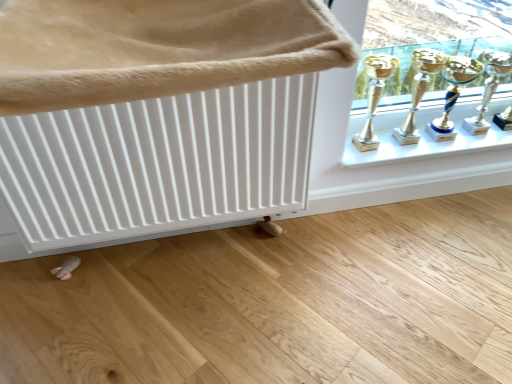
Question: From the image's perspective, is silver metallic trophy at upper right, the 1th candle holder when ordered from right to left, under white textured radiator at upper left?

Choices:
 (A) no
 (B) yes

Answer: (A)

Question: Is silver metallic trophy at upper right, acting as the 2th candle holder starting from the left, looking in the opposite direction of white textured radiator at upper left?

Choices:
 (A) no
 (B) yes

Answer: (A)

Question: Is silver metallic trophy at upper right, the 1th candle holder when ordered from right to left, not close to white textured radiator at upper left?

Choices:
 (A) yes
 (B) no

Answer: (A)

Question: From a real-world perspective, is silver metallic trophy at upper right, the 1th candle holder when ordered from right to left, located higher than white textured radiator at upper left?

Choices:
 (A) no
 (B) yes

Answer: (A)

Question: Can you confirm if silver metallic trophy at upper right, acting as the 2th candle holder starting from the left, is thinner than white textured radiator at upper left?

Choices:
 (A) yes
 (B) no

Answer: (A)

Question: From the image's perspective, is silver metallic trophy at upper right, the 1th candle holder when ordered from right to left, located above or below gold metallic trophy at upper right, acting as the second trophy starting from the left?

Choices:
 (A) below
 (B) above

Answer: (B)

Question: From their relative heights in the image, would you say silver metallic trophy at upper right, the 1th candle holder when ordered from right to left, is taller or shorter than gold metallic trophy at upper right, acting as the second trophy starting from the left?

Choices:
 (A) short
 (B) tall

Answer: (A)

Question: Is silver metallic trophy at upper right, acting as the 2th candle holder starting from the left, situated inside gold metallic trophy at upper right, acting as the second trophy starting from the left, or outside?

Choices:
 (A) inside
 (B) outside

Answer: (B)

Question: Considering the relative positions of silver metallic trophy at upper right, the 1th candle holder when ordered from right to left, and gold metallic trophy at upper right, which is the first trophy in right-to-left order, in the image provided, is silver metallic trophy at upper right, the 1th candle holder when ordered from right to left, to the left or to the right of gold metallic trophy at upper right, which is the first trophy in right-to-left order,?

Choices:
 (A) right
 (B) left

Answer: (A)

Question: From a real-world perspective, relative to gold metallic trophy at upper right, which is the 1th candle holder from left to right, is gold metallic trophy at upper right, marked as the second trophy in a right-to-left arrangement, vertically above or below?

Choices:
 (A) below
 (B) above

Answer: (B)

Question: In terms of height, does gold metallic trophy at upper right, marked as the second trophy in a right-to-left arrangement, look taller or shorter compared to gold metallic trophy at upper right, which ranks as the second candle holder in right-to-left order?

Choices:
 (A) short
 (B) tall

Answer: (B)

Question: Is point (369, 84) positioned closer to the camera than point (442, 135)?

Choices:
 (A) farther
 (B) closer

Answer: (B)

Question: Relative to gold metallic trophy at upper right, which ranks as the second candle holder in right-to-left order, is gold metallic trophy at upper right, marked as the second trophy in a right-to-left arrangement, in front or behind?

Choices:
 (A) front
 (B) behind

Answer: (A)

Question: Is silver metallic trophy at upper right, the 1th candle holder when ordered from right to left, taller or shorter than gold metallic trophy at upper right, marked as the second trophy in a right-to-left arrangement?

Choices:
 (A) short
 (B) tall

Answer: (A)

Question: Is silver metallic trophy at upper right, acting as the 2th candle holder starting from the left, wider or thinner than gold metallic trophy at upper right, marked as the 1th trophy in a left-to-right arrangement?

Choices:
 (A) thin
 (B) wide

Answer: (A)